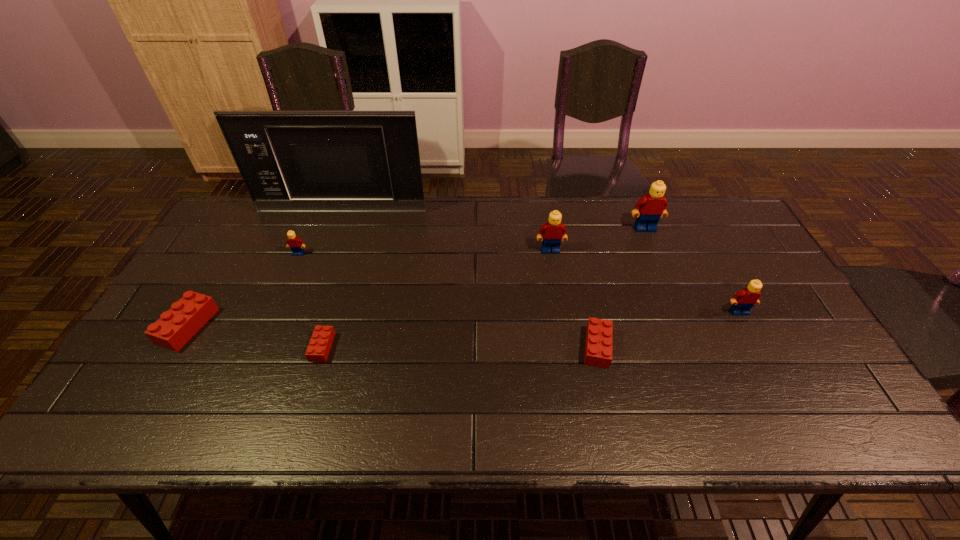
Where is `vacant space situated on the front-facing side of the fourth shortest object`? Image resolution: width=960 pixels, height=540 pixels. vacant space situated on the front-facing side of the fourth shortest object is located at coordinates (266, 332).

Find the location of a particular element. The height and width of the screenshot is (540, 960). free location located on the back of the third shortest object is located at coordinates point(246,227).

Identify the location of vacant space located on the right of the second smallest red Lego. (692, 347).

The image size is (960, 540). Identify the location of free point located on the left of the second red Lego from left to right. (234, 347).

Where is `microwave oven situated at the far edge`? microwave oven situated at the far edge is located at coordinates (299, 161).

At what (x,y) coordinates should I click in order to perform the action: click on Lego that is positioned at the far edge. Please return your answer as a coordinate pair (x, y). The width and height of the screenshot is (960, 540). Looking at the image, I should click on (653, 205).

Locate an element on the screen. microwave oven located at the left edge is located at coordinates (299, 161).

You are a GUI agent. You are given a task and a screenshot of the screen. Output one action in this format:
    pyautogui.click(x=<x>, y=<y>)
    Task: Click on the Lego at the left edge
    Image resolution: width=960 pixels, height=540 pixels.
    Given the screenshot: What is the action you would take?
    pyautogui.click(x=175, y=327)

Locate an element on the screen. This screenshot has height=540, width=960. object at the right edge is located at coordinates (744, 300).

This screenshot has width=960, height=540. I want to click on object situated at the far left corner, so click(299, 161).